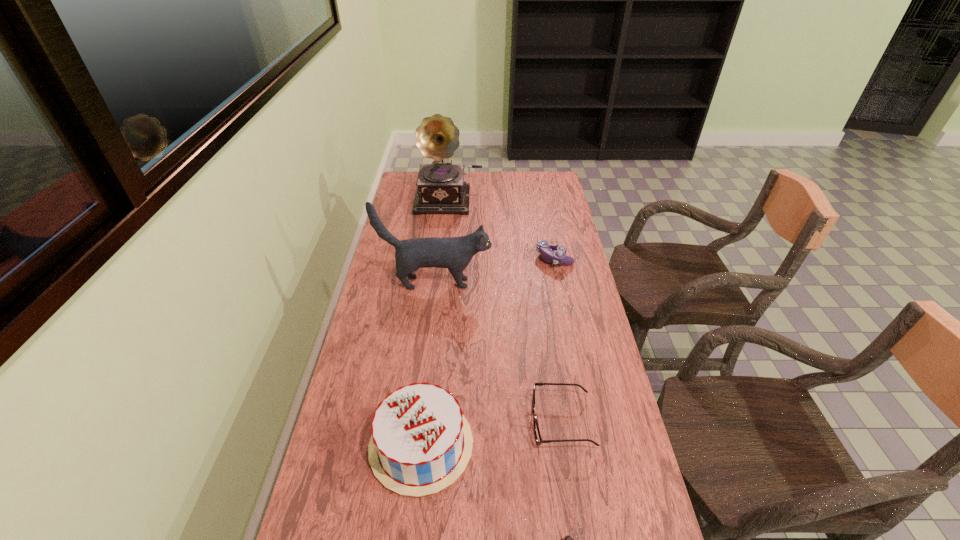
In order to click on record player in this screenshot , I will do `click(441, 188)`.

You are a GUI agent. You are given a task and a screenshot of the screen. Output one action in this format:
    pyautogui.click(x=<x>, y=<y>)
    Task: Click on the cat
    
    Given the screenshot: What is the action you would take?
    pyautogui.click(x=455, y=253)

The width and height of the screenshot is (960, 540). In order to click on the fifth shortest object in this screenshot , I will do `click(455, 253)`.

Find the location of `birthday cake`. birthday cake is located at coordinates (421, 442).

The height and width of the screenshot is (540, 960). Identify the location of the fifth nearest object. (547, 249).

The height and width of the screenshot is (540, 960). I want to click on the farther spectacles, so click(537, 434).

Find the location of `vacant space located 0.350m on the horn of the farthest object`. vacant space located 0.350m on the horn of the farthest object is located at coordinates (443, 267).

Where is `vacant space located at the face of the second tallest object`? This screenshot has height=540, width=960. vacant space located at the face of the second tallest object is located at coordinates (553, 283).

The image size is (960, 540). Identify the location of blank space located 0.070m on the back of the birthday cake. (428, 379).

The height and width of the screenshot is (540, 960). What are the coordinates of `vacant space located on the left of the fifth nearest object` in the screenshot? It's located at (472, 258).